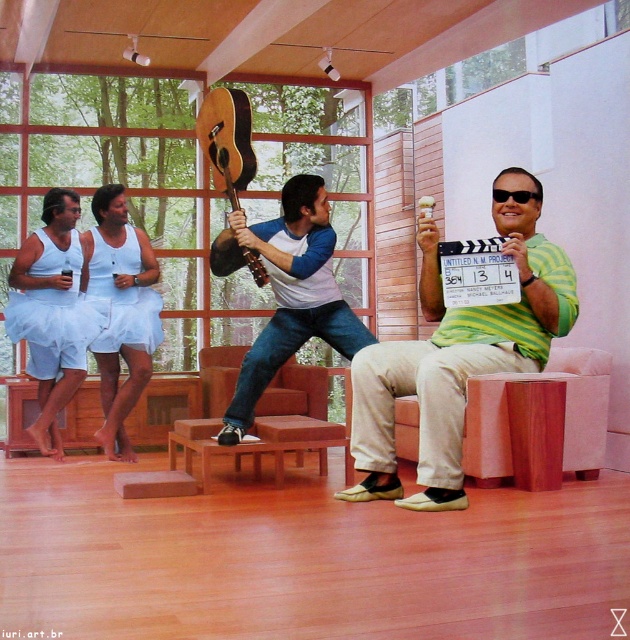
Question: Which point appears farthest from the camera in this image?

Choices:
 (A) (86, 317)
 (B) (227, 192)

Answer: (A)

Question: Is green striped shirt at center positioned before denim jeans at center?

Choices:
 (A) no
 (B) yes

Answer: (B)

Question: Which point appears farthest from the camera in this image?

Choices:
 (A) (220, 88)
 (B) (301, 300)
 (C) (47, 346)
 (D) (118, 236)

Answer: (D)

Question: Can you confirm if light blue tulle skirt at left is positioned above natural wood acoustic guitar at center?

Choices:
 (A) yes
 (B) no

Answer: (B)

Question: Which point is closer to the camera taking this photo?

Choices:
 (A) (427, 378)
 (B) (212, 112)
 (C) (28, 339)

Answer: (A)

Question: Does green striped shirt at center appear on the right side of white fabric skirt at left?

Choices:
 (A) yes
 (B) no

Answer: (A)